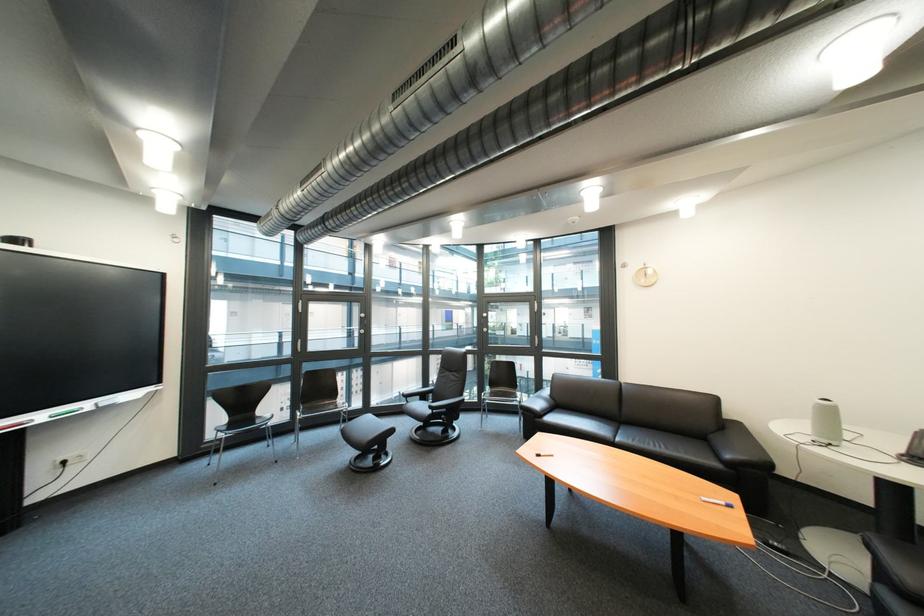
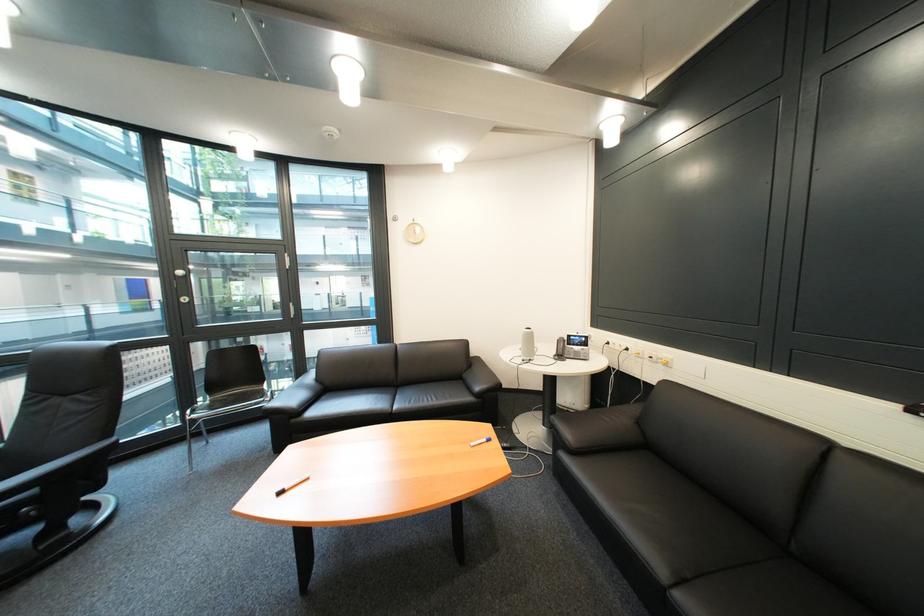
Question: Based on the continuous images, in which direction is the camera rotating? Reply with the corresponding letter.

Choices:
 (A) Left
 (B) Right
 (C) Up
 (D) Down

Answer: (B)